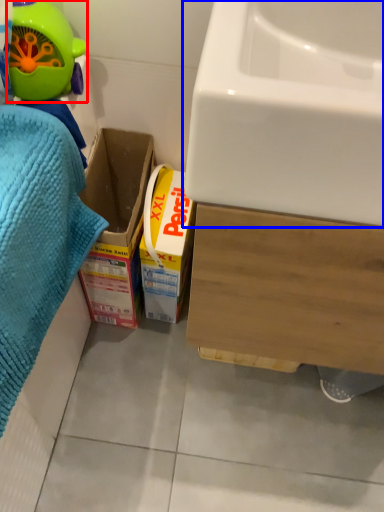
Question: Which object appears farthest to the camera in this image, toy (highlighted by a red box) or sink (highlighted by a blue box)?

Choices:
 (A) toy
 (B) sink

Answer: (A)